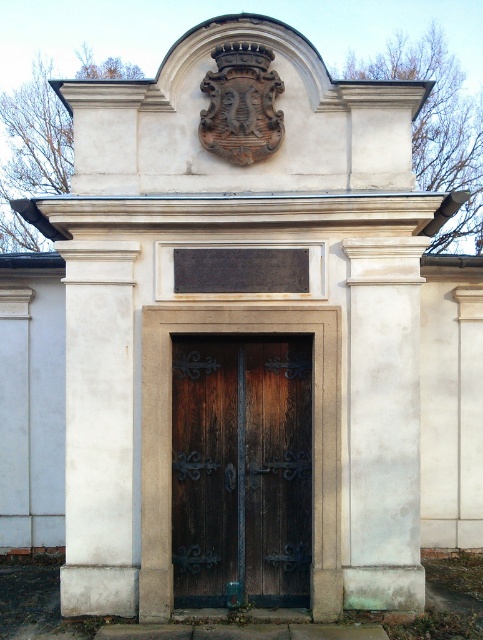
Question: Does white stone column at right appear on the right side of white stone column at left?

Choices:
 (A) yes
 (B) no

Answer: (A)

Question: Can you confirm if white stone column at right is smaller than white stone column at left?

Choices:
 (A) no
 (B) yes

Answer: (B)

Question: Which is farther from the white stone column at right?

Choices:
 (A) dark wood door at center
 (B) white stone column at left

Answer: (B)

Question: Considering the real-world distances, which object is closest to the white stone column at left?

Choices:
 (A) dark wood door at center
 (B) white stone column at right

Answer: (A)

Question: Which object is positioned closest to the white stone column at right?

Choices:
 (A) white stone column at left
 (B) dark wood door at center

Answer: (B)

Question: Does dark wood door at center appear under white stone column at right?

Choices:
 (A) yes
 (B) no

Answer: (A)